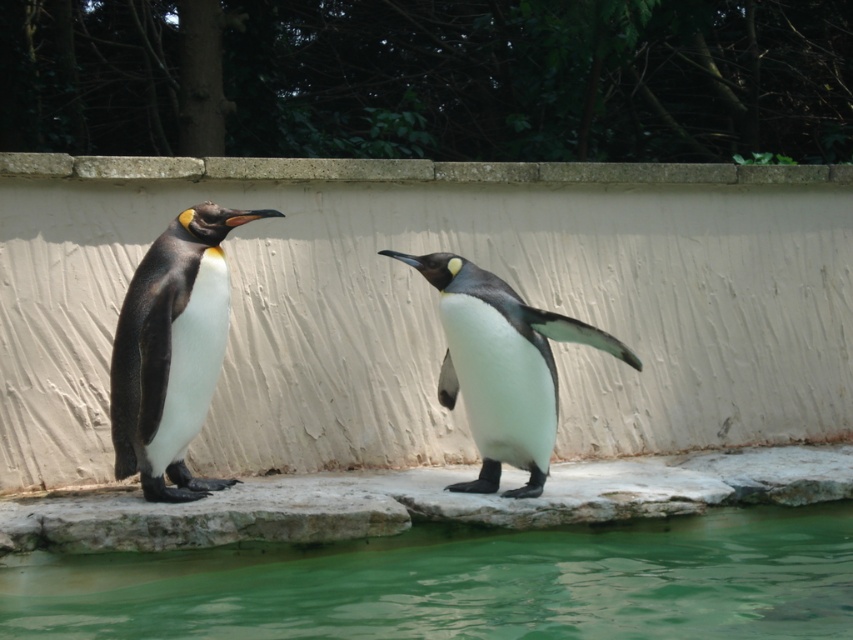
Which is behind, point (538, 332) or point (766, 177)?

Positioned behind is point (766, 177).

Consider the image. Between white matte penguin at center and smooth concrete ledge at upper center, which one appears on the right side from the viewer's perspective?

From the viewer's perspective, white matte penguin at center appears more on the right side.

In the scene shown: Measure the distance between point (456, 288) and camera.

Point (456, 288) and camera are 6.13 meters apart from each other.

This screenshot has height=640, width=853. Find the location of `white matte penguin at center`. white matte penguin at center is located at coordinates (502, 365).

Between matte black penguin at left and white matte penguin at center, which one has less height?

white matte penguin at center

Does matte black penguin at left appear on the left side of white matte penguin at center?

Indeed, matte black penguin at left is positioned on the left side of white matte penguin at center.

Measure the distance between point (x=155, y=490) and camera.

Point (x=155, y=490) is 20.10 feet from camera.

Locate an element on the screen. matte black penguin at left is located at coordinates (172, 352).

Can you confirm if green liquid water at lower center is thinner than smooth concrete ledge at upper center?

Yes, green liquid water at lower center is thinner than smooth concrete ledge at upper center.

Who is lower down, green liquid water at lower center or smooth concrete ledge at upper center?

green liquid water at lower center is below.

Find the location of a particular element. The width and height of the screenshot is (853, 640). green liquid water at lower center is located at coordinates 467,582.